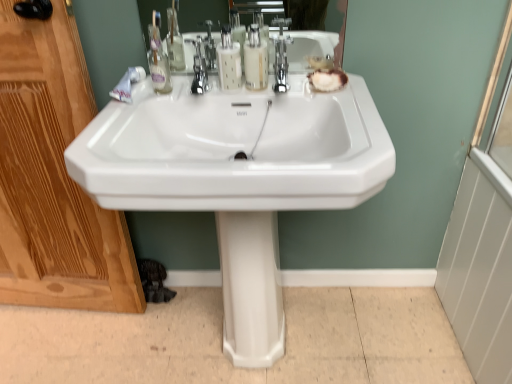
Identify the location of vacant location below white glossy sink at center (from a real-world perspective). (256, 368).